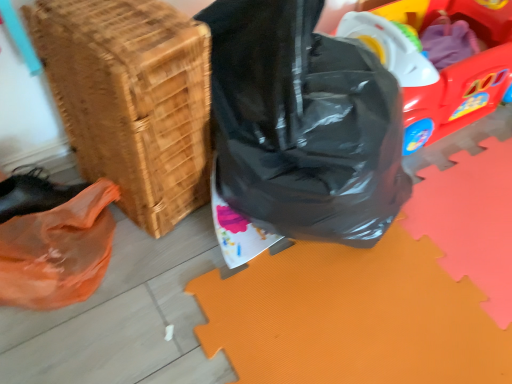
Measure the distance between woven wood basket at lower left and camera.

The depth of woven wood basket at lower left is 69.18 centimeters.

The height and width of the screenshot is (384, 512). What are the coordinates of `woven wood basket at lower left` in the screenshot? It's located at (131, 99).

Where is `black plastic bag at center`? This screenshot has width=512, height=384. black plastic bag at center is located at coordinates (303, 124).

This screenshot has height=384, width=512. Describe the element at coordinates (434, 67) in the screenshot. I see `rubberized plastic wagon at upper right` at that location.

I want to click on woven wood basket at lower left, so tap(131, 99).

Consider the image. From a real-world perspective, who is located lower, woven wood basket at lower left or black plastic bag at center?

woven wood basket at lower left.

Is black plastic bag at center at the back of woven wood basket at lower left?

That's not correct — woven wood basket at lower left is not looking away from black plastic bag at center.

Considering the positions of point (114, 1) and point (330, 214), is point (114, 1) closer or farther from the camera than point (330, 214)?

Point (114, 1) is closer to the camera than point (330, 214).

Can black plastic bag at center be found inside woven wood basket at lower left?

No, black plastic bag at center is not inside woven wood basket at lower left.

Looking at this image, from a real-world perspective, which is physically below, black plastic bag at center or rubberized plastic wagon at upper right?

In real-world perspective, rubberized plastic wagon at upper right is lower.

Consider the image. Which of these two, black plastic bag at center or rubberized plastic wagon at upper right, stands taller?

black plastic bag at center.

Is black plastic bag at center outside of rubberized plastic wagon at upper right?

Yes.

Locate an element on the screen. This screenshot has width=512, height=384. plastic bag that is below the rubberized plastic wagon at upper right (from the image's perspective) is located at coordinates (303, 124).

Can you tell me how much rubberized plastic wagon at upper right and black plastic bag at center differ in facing direction?

0.00174 degrees.

Based on the photo, which object is wider, rubberized plastic wagon at upper right or black plastic bag at center?

rubberized plastic wagon at upper right.

Which is closer to the camera, (440, 97) or (358, 122)?

Point (440, 97) is farther from the camera than point (358, 122).

In the scene shown: Is rubberized plastic wagon at upper right next to black plastic bag at center?

No, rubberized plastic wagon at upper right is not with black plastic bag at center.

Measure the distance between rubberized plastic wagon at upper right and woven wood basket at lower left.

They are 28.48 inches apart.

Between rubberized plastic wagon at upper right and woven wood basket at lower left, which one has more height?

woven wood basket at lower left is taller.

Is rubberized plastic wagon at upper right at the left side of woven wood basket at lower left?

In fact, rubberized plastic wagon at upper right is to the right of woven wood basket at lower left.

From the image's perspective, is rubberized plastic wagon at upper right located beneath woven wood basket at lower left?

Incorrect, from the image's perspective, rubberized plastic wagon at upper right is higher than woven wood basket at lower left.

From a real-world perspective, which object rests below the other?

rubberized plastic wagon at upper right is physically lower.

Which object is further away from the camera taking this photo, woven wood basket at lower left or rubberized plastic wagon at upper right?

rubberized plastic wagon at upper right is behind.

Is woven wood basket at lower left not near rubberized plastic wagon at upper right?

That's not correct — woven wood basket at lower left is a little close to rubberized plastic wagon at upper right.

Is woven wood basket at lower left facing away from rubberized plastic wagon at upper right?

No, woven wood basket at lower left is not facing away from rubberized plastic wagon at upper right.

Between black plastic bag at center and woven wood basket at lower left, which one appears on the right side from the viewer's perspective?

black plastic bag at center.

Who is taller, black plastic bag at center or woven wood basket at lower left?

Result: Standing taller between the two is black plastic bag at center.

Where is `basket behind the black plastic bag at center`? basket behind the black plastic bag at center is located at coordinates (131, 99).

Where is `plastic bag on the right of woven wood basket at lower left`? plastic bag on the right of woven wood basket at lower left is located at coordinates (x=303, y=124).

The image size is (512, 384). Identify the location of wagon below the black plastic bag at center (from a real-world perspective). (434, 67).

Based on their spatial positions, is woven wood basket at lower left or black plastic bag at center closer to rubberized plastic wagon at upper right?

black plastic bag at center is closer to rubberized plastic wagon at upper right.

When comparing their distances from rubberized plastic wagon at upper right, does black plastic bag at center or woven wood basket at lower left seem further?

woven wood basket at lower left lies further to rubberized plastic wagon at upper right than the other object.

Looking at the image, which one is located closer to black plastic bag at center, rubberized plastic wagon at upper right or woven wood basket at lower left?

woven wood basket at lower left.

When comparing their distances from woven wood basket at lower left, does rubberized plastic wagon at upper right or black plastic bag at center seem further?

rubberized plastic wagon at upper right lies further to woven wood basket at lower left than the other object.

Which object lies further to the anchor point woven wood basket at lower left, black plastic bag at center or rubberized plastic wagon at upper right?

rubberized plastic wagon at upper right lies further to woven wood basket at lower left than the other object.

Considering their positions, is woven wood basket at lower left positioned further to black plastic bag at center than rubberized plastic wagon at upper right?

rubberized plastic wagon at upper right is further to black plastic bag at center.

I want to click on plastic bag between woven wood basket at lower left and rubberized plastic wagon at upper right from left to right, so click(x=303, y=124).